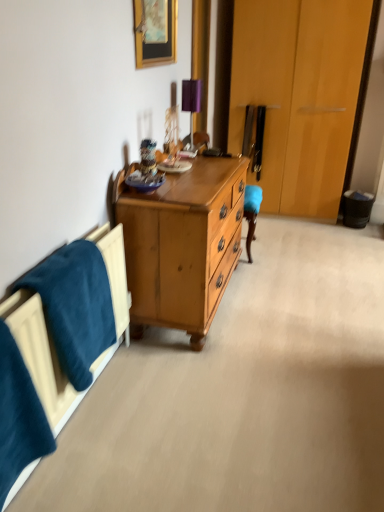
Question: Does purple fabric table lamp at upper center have a smaller size compared to velvety blue blanket at lower left, arranged as the first blanket when viewed from the back?

Choices:
 (A) yes
 (B) no

Answer: (A)

Question: Would you say velvety blue blanket at lower left, arranged as the first blanket when viewed from the back, is part of purple fabric table lamp at upper center's contents?

Choices:
 (A) no
 (B) yes

Answer: (A)

Question: From the image's perspective, is purple fabric table lamp at upper center over velvety blue blanket at lower left, which is the second blanket in front-to-back order?

Choices:
 (A) no
 (B) yes

Answer: (B)

Question: From a real-world perspective, does purple fabric table lamp at upper center stand above velvety blue blanket at lower left, arranged as the first blanket when viewed from the back?

Choices:
 (A) no
 (B) yes

Answer: (B)

Question: From the image's perspective, is purple fabric table lamp at upper center located beneath velvety blue blanket at lower left, which is the second blanket in front-to-back order?

Choices:
 (A) no
 (B) yes

Answer: (A)

Question: Does purple fabric table lamp at upper center have a lesser height compared to velvety blue blanket at lower left, arranged as the first blanket when viewed from the back?

Choices:
 (A) no
 (B) yes

Answer: (B)

Question: Is purple fabric table lamp at upper center closer to camera compared to velvety blue blanket at lower left, which is the first blanket in front-to-back order?

Choices:
 (A) yes
 (B) no

Answer: (B)

Question: Is purple fabric table lamp at upper center shorter than velvety blue blanket at lower left, which is the first blanket in front-to-back order?

Choices:
 (A) no
 (B) yes

Answer: (B)

Question: Is purple fabric table lamp at upper center far from velvety blue blanket at lower left, which is the first blanket in front-to-back order?

Choices:
 (A) no
 (B) yes

Answer: (B)

Question: From the image's perspective, does purple fabric table lamp at upper center appear lower than velvety blue blanket at lower left, which is the 2th blanket in back-to-front order?

Choices:
 (A) no
 (B) yes

Answer: (A)

Question: Is purple fabric table lamp at upper center next to velvety blue blanket at lower left, which is the first blanket in front-to-back order?

Choices:
 (A) no
 (B) yes

Answer: (A)

Question: Can we say purple fabric table lamp at upper center lies outside velvety blue blanket at lower left, which is the 2th blanket in back-to-front order?

Choices:
 (A) yes
 (B) no

Answer: (A)

Question: Is purple fabric table lamp at upper center not inside wooden picture frame at upper center?

Choices:
 (A) yes
 (B) no

Answer: (A)